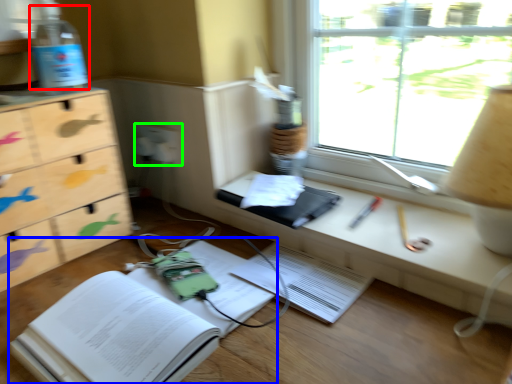
Question: Which object is the farthest from bottle (highlighted by a red box)? Choose among these: paperback book (highlighted by a blue box) or electric outlet (highlighted by a green box).

Choices:
 (A) paperback book
 (B) electric outlet

Answer: (A)